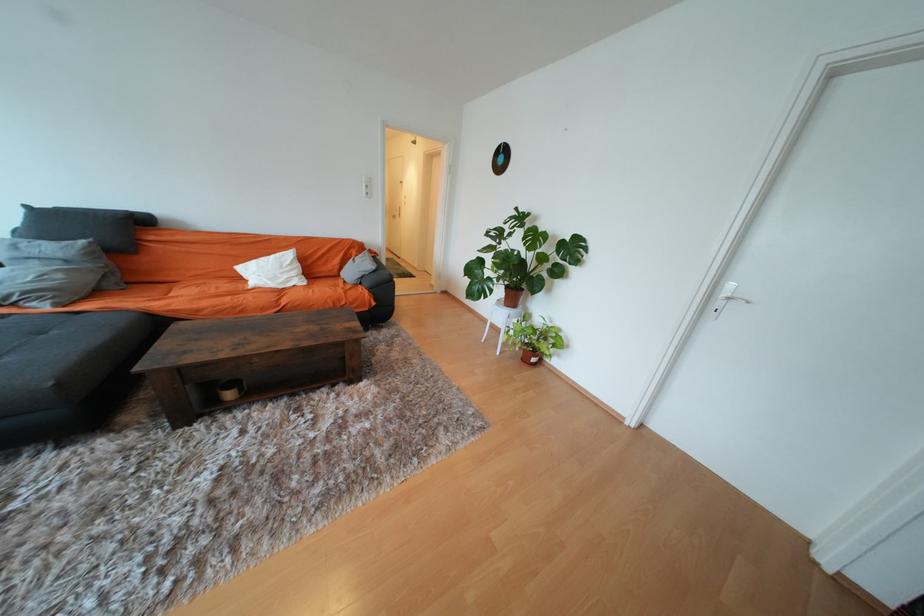
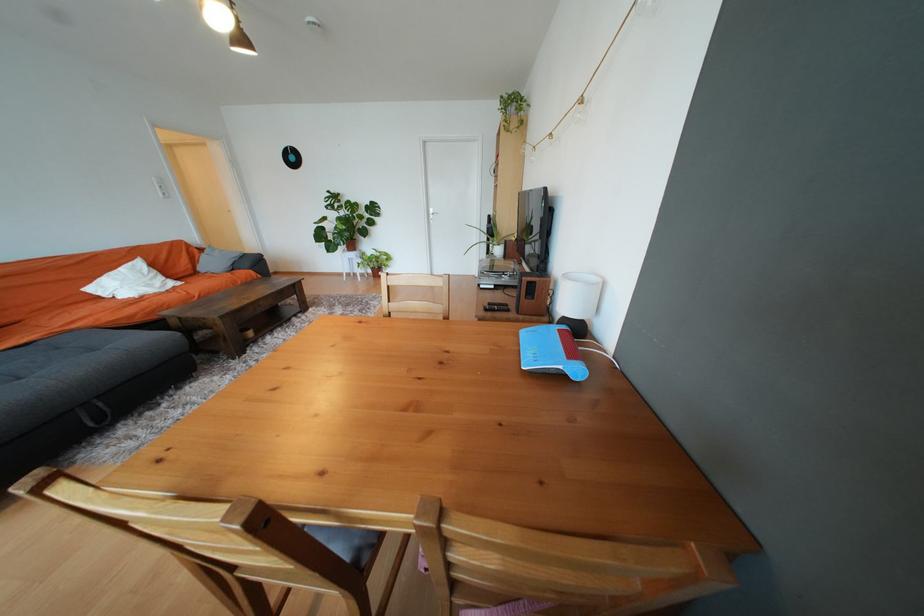
Locate, in the second image, the point that corresponds to (246,270) in the first image.

(96, 291)